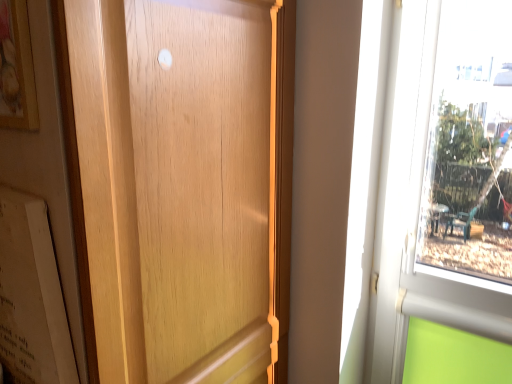
Question: Is matte white paper at left surrounded by wooden picture frame at upper left?

Choices:
 (A) yes
 (B) no

Answer: (B)

Question: Is wooden picture frame at upper left in contact with matte white paper at left?

Choices:
 (A) yes
 (B) no

Answer: (B)

Question: Is wooden picture frame at upper left to the right of matte white paper at left from the viewer's perspective?

Choices:
 (A) yes
 (B) no

Answer: (A)

Question: Is wooden picture frame at upper left completely or partially outside of matte white paper at left?

Choices:
 (A) yes
 (B) no

Answer: (A)

Question: Is wooden picture frame at upper left further to camera compared to matte white paper at left?

Choices:
 (A) no
 (B) yes

Answer: (A)

Question: Is the depth of wooden picture frame at upper left less than that of matte white paper at left?

Choices:
 (A) yes
 (B) no

Answer: (A)

Question: Does matte white paper at left have a lesser width compared to wooden picture frame at upper left?

Choices:
 (A) yes
 (B) no

Answer: (B)

Question: Is wooden picture frame at upper left at the back of matte white paper at left?

Choices:
 (A) yes
 (B) no

Answer: (B)

Question: Can you confirm if matte white paper at left is bigger than wooden picture frame at upper left?

Choices:
 (A) yes
 (B) no

Answer: (A)

Question: From a real-world perspective, is matte white paper at left physically below wooden picture frame at upper left?

Choices:
 (A) no
 (B) yes

Answer: (B)

Question: Is matte white paper at left far away from wooden picture frame at upper left?

Choices:
 (A) yes
 (B) no

Answer: (B)

Question: Considering the relative positions of matte white paper at left and wooden picture frame at upper left in the image provided, is matte white paper at left behind wooden picture frame at upper left?

Choices:
 (A) yes
 (B) no

Answer: (A)

Question: From the image's perspective, would you say wooden door at center is positioned over wooden picture frame at upper left?

Choices:
 (A) no
 (B) yes

Answer: (A)